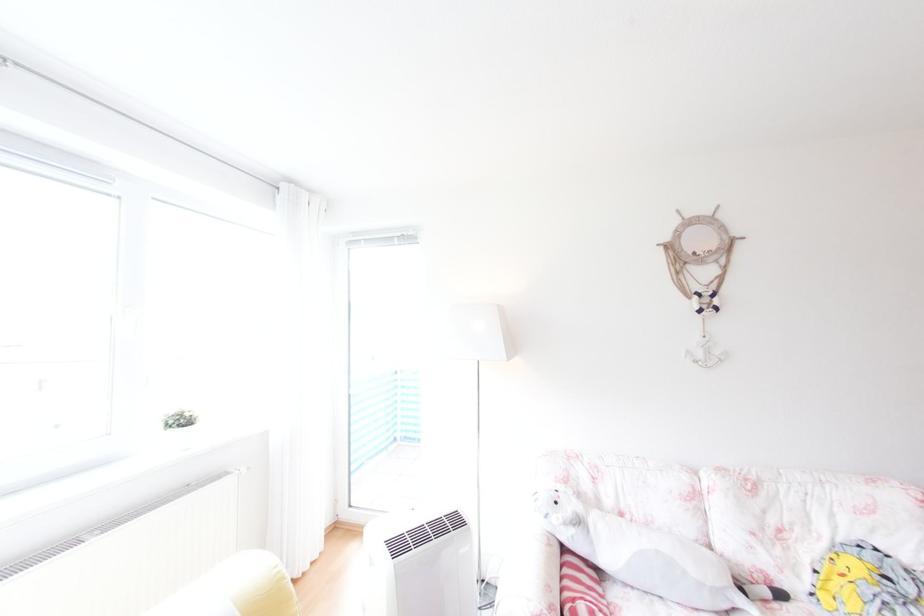
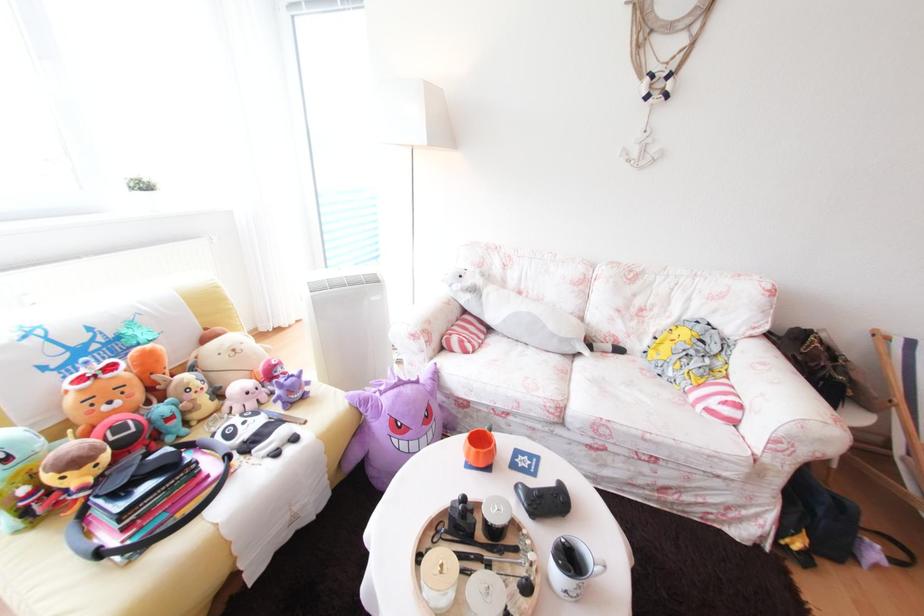
Question: Which direction would the cameraman need to move to produce the second image? Reply with the corresponding letter.

Choices:
 (A) Left
 (B) Right
 (C) Forward
 (D) Backward

Answer: (B)